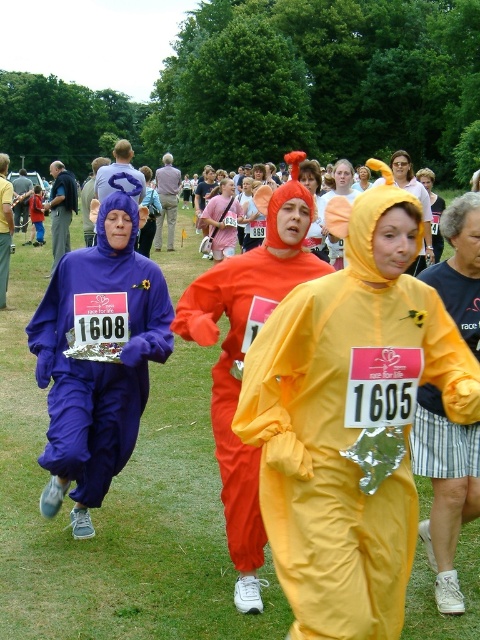
Question: Does purple matte jumpsuit at left come in front of matte yellow costume at center?

Choices:
 (A) yes
 (B) no

Answer: (B)

Question: Can you confirm if yellow shiny raincoat at center is positioned below orange matte costume at center?

Choices:
 (A) yes
 (B) no

Answer: (A)

Question: Which point is farther to the camera?

Choices:
 (A) (271, 220)
 (B) (327, 435)

Answer: (A)

Question: Which object appears closest to the camera in this image?

Choices:
 (A) orange fabric costume at center
 (B) matte yellow costume at center
 (C) matte purple costume at left

Answer: (B)

Question: Which point is farther from the camera taking this photo?

Choices:
 (A) (163, 164)
 (B) (240, 273)

Answer: (A)

Question: Can you confirm if yellow shiny raincoat at center is positioned to the right of orange fabric costume at center?

Choices:
 (A) yes
 (B) no

Answer: (A)